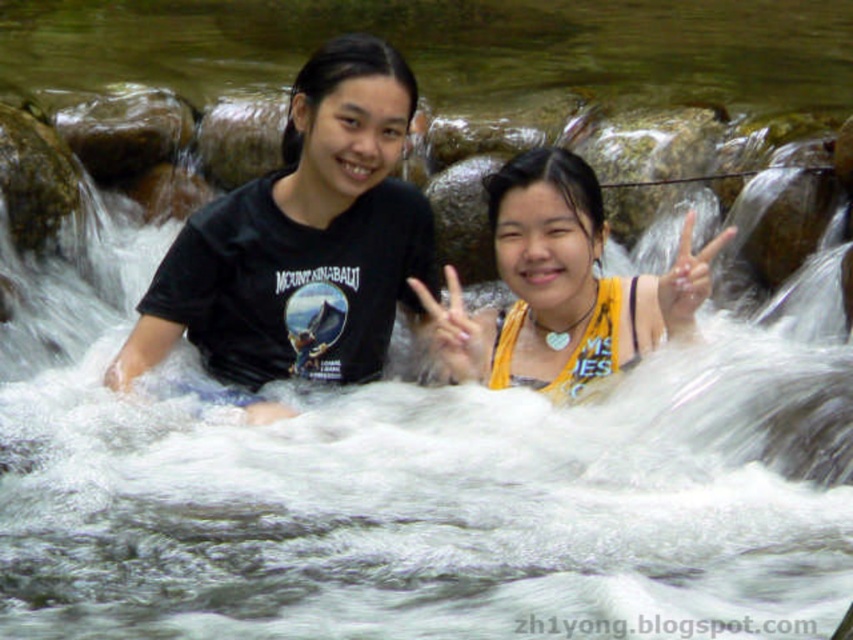
Question: Which of the following is the closest to the observer?

Choices:
 (A) (567, 273)
 (B) (318, 216)

Answer: (A)

Question: Where is black matte t-shirt at center located in relation to yellow fabric at center in the image?

Choices:
 (A) below
 (B) above

Answer: (B)

Question: Is black matte t-shirt at center above yellow fabric at center?

Choices:
 (A) no
 (B) yes

Answer: (B)

Question: Is black matte t-shirt at center bigger than yellow fabric at center?

Choices:
 (A) yes
 (B) no

Answer: (B)

Question: Which object is farther from the camera taking this photo?

Choices:
 (A) yellow fabric at center
 (B) black matte t-shirt at center

Answer: (B)